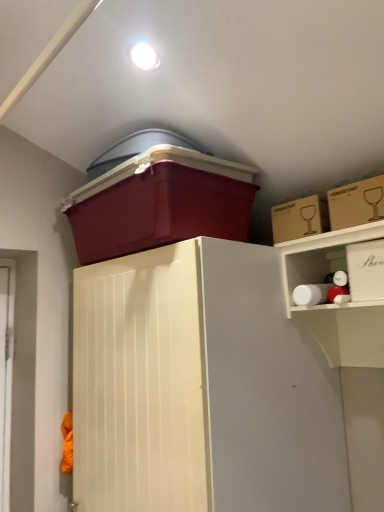
Question: Is the depth of cardboard box at upper right, placed as the second storage box when sorted from right to left, less than that of white cardboard box at upper right, the 1th storage box from the right?

Choices:
 (A) no
 (B) yes

Answer: (A)

Question: Would you say cardboard box at upper right, which is counted as the 3th storage box, starting from the left, contains white cardboard box at upper right, which ranks as the 4th storage box in left-to-right order?

Choices:
 (A) no
 (B) yes

Answer: (A)

Question: Is cardboard box at upper right, which is counted as the 3th storage box, starting from the left, located outside white cardboard box at upper right, which ranks as the 4th storage box in left-to-right order?

Choices:
 (A) no
 (B) yes

Answer: (B)

Question: Is cardboard box at upper right, placed as the second storage box when sorted from right to left, far from white cardboard box at upper right, which ranks as the 4th storage box in left-to-right order?

Choices:
 (A) no
 (B) yes

Answer: (A)

Question: From a real-world perspective, is cardboard box at upper right, which is counted as the 3th storage box, starting from the left, located beneath white cardboard box at upper right, the 1th storage box from the right?

Choices:
 (A) no
 (B) yes

Answer: (A)

Question: From a real-world perspective, is cardboard box at upper right, placed as the second storage box when sorted from right to left, above or below matte plastic storage box at upper center, the fourth storage box when ordered from right to left?

Choices:
 (A) below
 (B) above

Answer: (A)

Question: Would you say cardboard box at upper right, which is counted as the 3th storage box, starting from the left, is to the left or to the right of matte plastic storage box at upper center, arranged as the first storage box when viewed from the left, in the picture?

Choices:
 (A) right
 (B) left

Answer: (A)

Question: Relative to matte plastic storage box at upper center, arranged as the first storage box when viewed from the left, is cardboard box at upper right, placed as the second storage box when sorted from right to left, in front or behind?

Choices:
 (A) front
 (B) behind

Answer: (B)

Question: Considering the positions of cardboard box at upper right, which is counted as the 3th storage box, starting from the left, and matte plastic storage box at upper center, the fourth storage box when ordered from right to left, in the image, is cardboard box at upper right, which is counted as the 3th storage box, starting from the left, wider or thinner than matte plastic storage box at upper center, the fourth storage box when ordered from right to left,?

Choices:
 (A) wide
 (B) thin

Answer: (B)

Question: Is cardboard box at upper right, which ranks as the third storage box in right-to-left order, taller or shorter than matte plastic storage box at upper center, arranged as the first storage box when viewed from the left?

Choices:
 (A) tall
 (B) short

Answer: (B)

Question: Does point (283, 204) appear closer or farther from the camera than point (200, 181)?

Choices:
 (A) farther
 (B) closer

Answer: (A)

Question: Based on their sizes in the image, would you say cardboard box at upper right, marked as the second storage box in a left-to-right arrangement, is bigger or smaller than matte plastic storage box at upper center, arranged as the first storage box when viewed from the left?

Choices:
 (A) small
 (B) big

Answer: (A)

Question: From a real-world perspective, is cardboard box at upper right, marked as the second storage box in a left-to-right arrangement, physically located above or below matte plastic storage box at upper center, arranged as the first storage box when viewed from the left?

Choices:
 (A) above
 (B) below

Answer: (B)

Question: Is point (135, 172) closer or farther from the camera than point (301, 204)?

Choices:
 (A) closer
 (B) farther

Answer: (A)

Question: From the image's perspective, is matte plastic storage box at upper center, arranged as the first storage box when viewed from the left, located above or below cardboard box at upper right, which ranks as the third storage box in right-to-left order?

Choices:
 (A) above
 (B) below

Answer: (A)